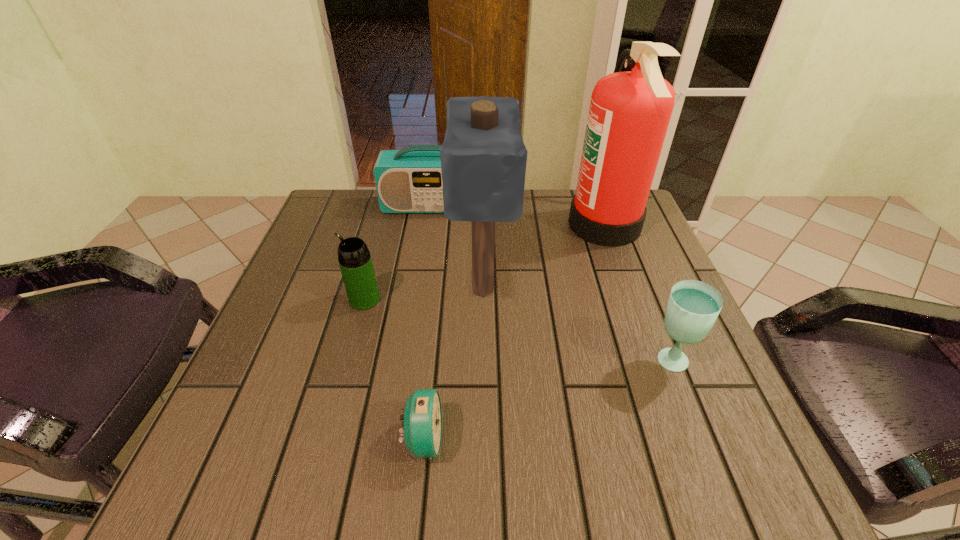
At what (x,y) coordinates should I click in order to perform the action: click on fire extinguisher at the right edge. Please return your answer as a coordinate pair (x, y). The image size is (960, 540). Looking at the image, I should click on (629, 113).

The image size is (960, 540). I want to click on glass positioned at the right edge, so click(x=693, y=306).

In order to click on object at the far right corner in this screenshot , I will do (629, 113).

You are a GUI agent. You are given a task and a screenshot of the screen. Output one action in this format:
    pyautogui.click(x=<x>, y=<y>)
    Task: Click on the free region at the far edge of the desktop
    
    Given the screenshot: What is the action you would take?
    pyautogui.click(x=468, y=224)

Identify the location of vacant space at the near edge of the desktop. The height and width of the screenshot is (540, 960). point(413,478).

Where is `vacant space at the left edge of the desktop`? The height and width of the screenshot is (540, 960). vacant space at the left edge of the desktop is located at coordinates (300, 366).

Find the location of `free spot at the right edge of the desktop`. free spot at the right edge of the desktop is located at coordinates click(x=608, y=295).

In the image, there is a desktop. What are the coordinates of `vacant space at the far left corner` in the screenshot? It's located at (355, 205).

Find the location of `vacant region between the radio receiver and the fifth farthest object`. vacant region between the radio receiver and the fifth farthest object is located at coordinates (550, 284).

You are a GUI agent. You are given a task and a screenshot of the screen. Output one action in this format:
    pyautogui.click(x=<x>, y=<y>)
    Task: Click on the free space that is in between the nearest object and the mallet
    This screenshot has width=960, height=540.
    Given the screenshot: What is the action you would take?
    [453, 364]